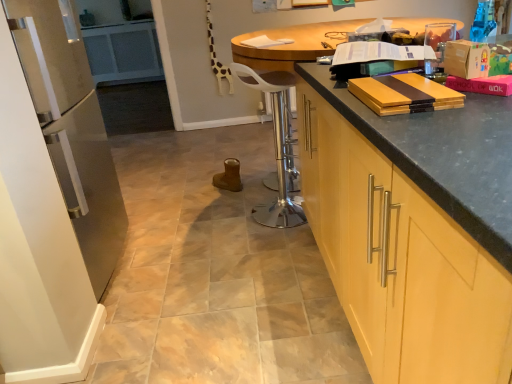
I want to click on vacant area on the back side of white glossy refrigerator at left, so click(157, 213).